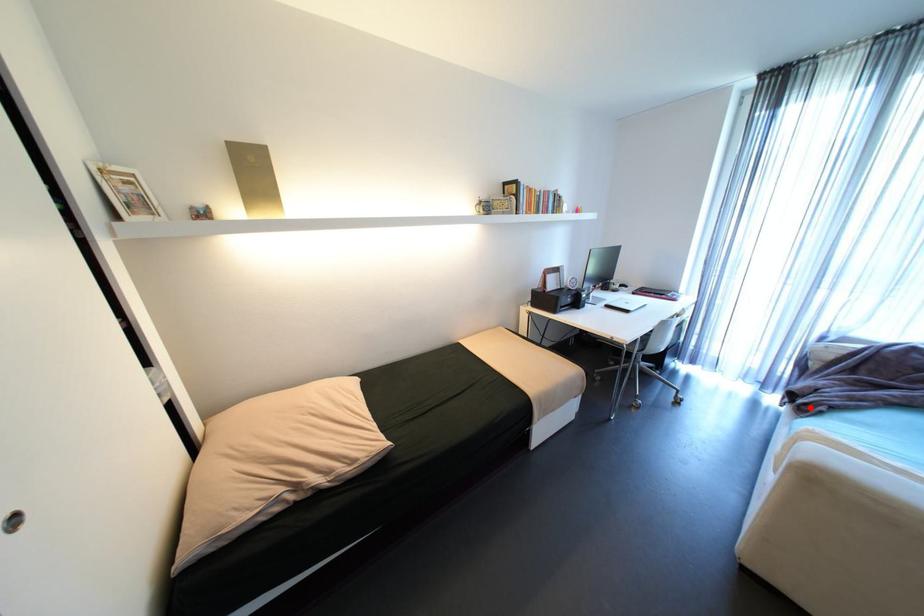
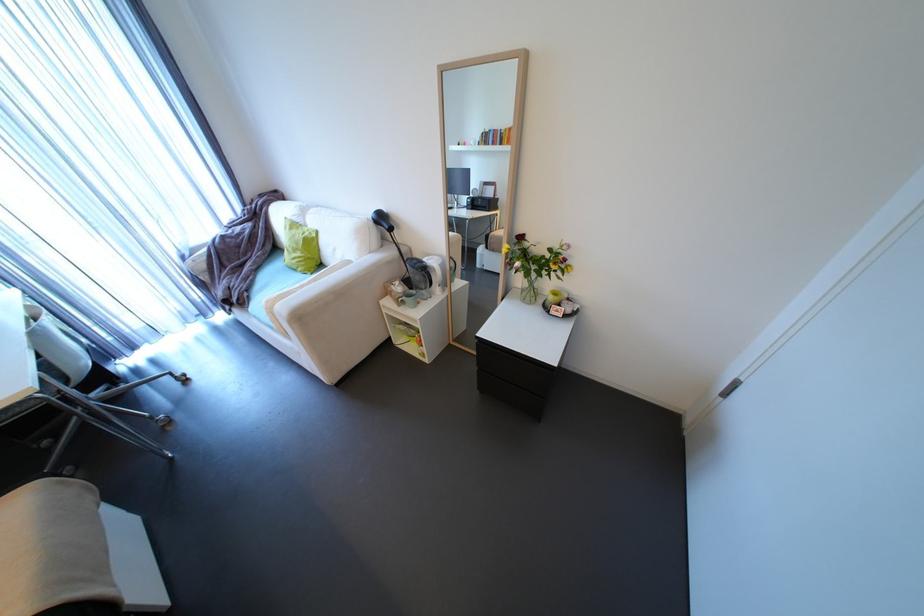
Question: I am providing you with two images of the same scene from different viewpoints. Given a red point in image1, look at the same physical point in image2. Is it:

Choices:
 (A) Closer to the viewpoint
 (B) Farther from the viewpoint

Answer: (B)